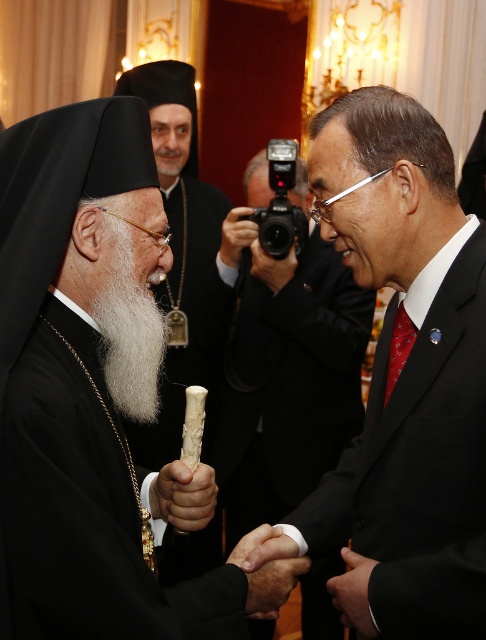
Between point (427, 227) and point (104, 305), which one is positioned behind?

The point (427, 227) is more distant.

At what (x,y) coordinates should I click in order to perform the action: click on smooth black suit at center. Please return your answer as a coordinate pair (x, y). The image size is (486, 640). Looking at the image, I should click on (403, 378).

I want to click on smooth black suit at center, so click(x=403, y=378).